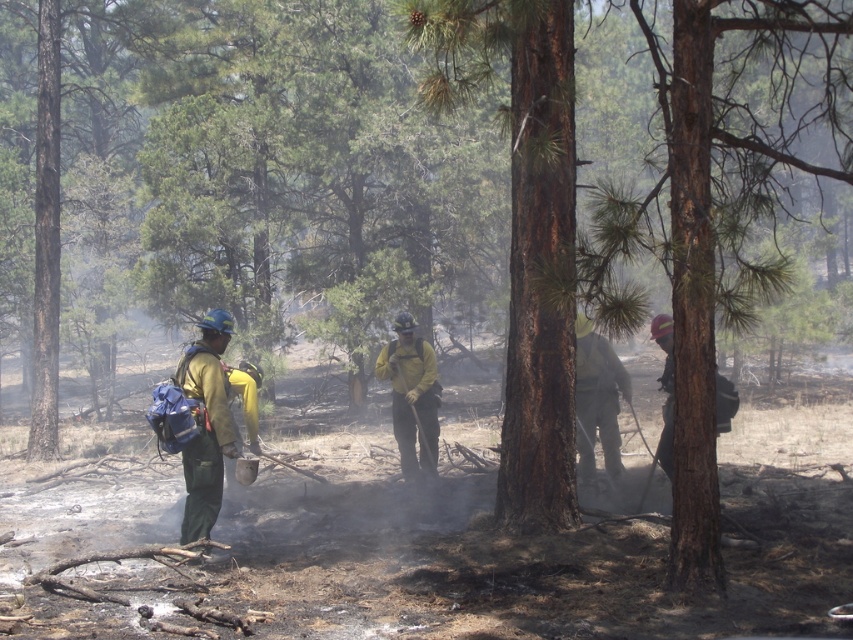
Is point (221, 460) closer to viewer compared to point (579, 387)?

Yes, point (221, 460) is closer to viewer.

Image resolution: width=853 pixels, height=640 pixels. What are the coordinates of `yellow-green uniform at center-left` in the screenshot? It's located at (207, 422).

Between yellow fire-resistant suit at center and green reflective vest at center, which one appears on the left side from the viewer's perspective?

yellow fire-resistant suit at center is more to the left.

You are a GUI agent. You are given a task and a screenshot of the screen. Output one action in this format:
    pyautogui.click(x=<x>, y=<y>)
    Task: Click on the yellow fire-resistant suit at center
    
    Given the screenshot: What is the action you would take?
    pyautogui.click(x=410, y=396)

Who is more forward, [413,364] or [590,320]?

Point [590,320] is more forward.

Locate an element on the screen. This screenshot has height=640, width=853. yellow fire-resistant suit at center is located at coordinates (410, 396).

Does yellow-green uniform at center-left have a smaller size compared to yellow fire-resistant suit at center?

Yes.

Is yellow-green uniform at center-left below yellow fire-resistant suit at center?

Indeed, yellow-green uniform at center-left is positioned under yellow fire-resistant suit at center.

Does point (204, 477) lie behind point (426, 403)?

No, it is not.

The width and height of the screenshot is (853, 640). What are the coordinates of `yellow-green uniform at center-left` in the screenshot? It's located at (207, 422).